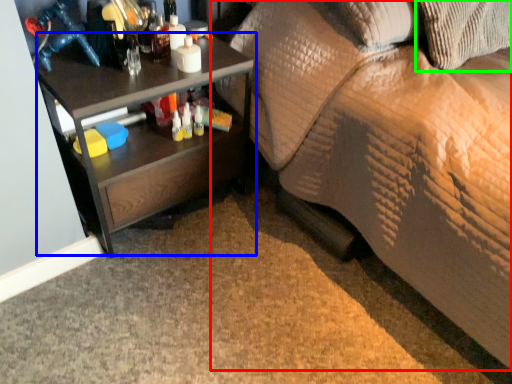
Question: Based on their relative distances, which object is farther from studio couch (highlighted by a red box)? Choose from desk (highlighted by a blue box) and pillow (highlighted by a green box).

Choices:
 (A) desk
 (B) pillow

Answer: (A)